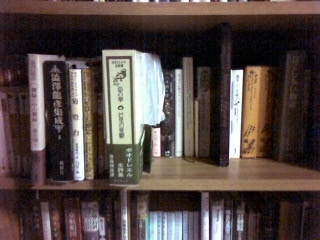
At what (x,y) coordinates should I click in order to perform the action: click on room beyond bookcase. Please return your answer as a coordinate pair (x, y). Looking at the image, I should click on (1, 121), (1, 87).